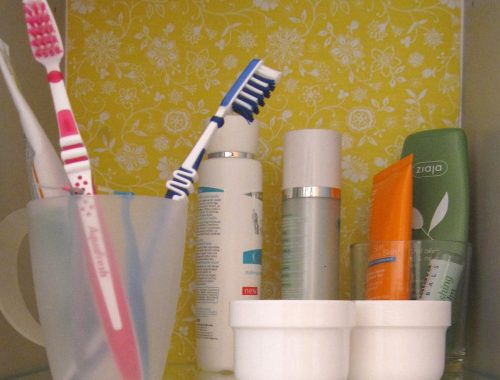
Where is `1 blue toothbrush`? This screenshot has height=380, width=500. 1 blue toothbrush is located at coordinates (246, 85).